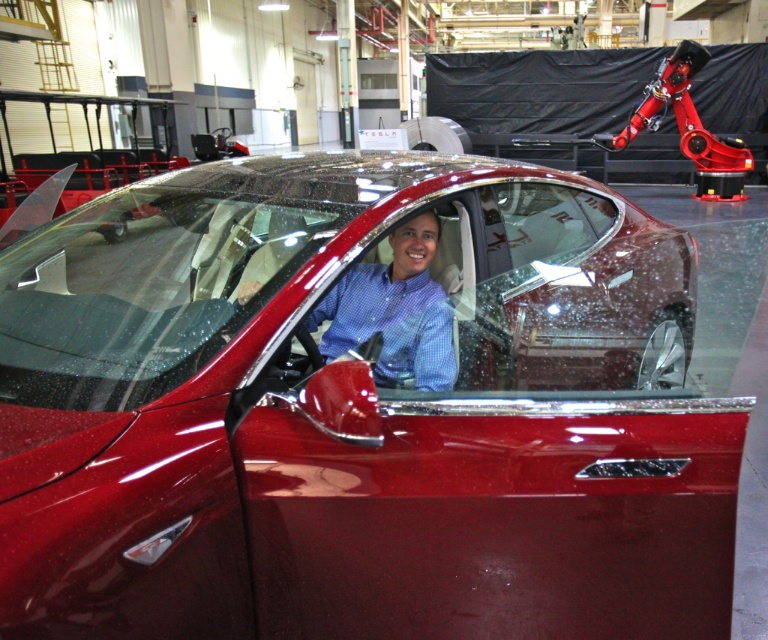
You are a photographer standing 1 meter away from the clear glass windshield at center. You want to take a photo of the blue checkered shirt at center through the windshield. Considering the distance between the two, will the shirt be in focus if your camera has a depth of field that can capture objects up to 1.2 meters away?

The clear glass windshield at center is 21.22 centimeters away from the blue checkered shirt at center. Since the total distance from the photographer to the shirt would be 1 meter plus 21.22 centimeters, totaling 1.2122 meters, which is just within the camera lens depth of field limit of 1.2 meters. However, this is very close to the limit and may result in slight blurriness depending on the exact focus settings.

You are a photographer trying to capture a clear shot of the blue checkered shirt at center and the clear glass windshield at center. Since both are in the same frame, which object will require a closer focus to ensure clarity?

The blue checkered shirt at center requires closer focus because it is smaller in size compared to the clear glass windshield at center, which is larger. Since the shirt is smaller, it needs to be in focus more precisely to capture details.

You are standing in front of the Tesla Model S with its door open. You notice the clear glass windshield at center and the blue checkered shirt at center. Which object is closer to you?

The clear glass windshield at center is closer to the viewer than the blue checkered shirt at center.